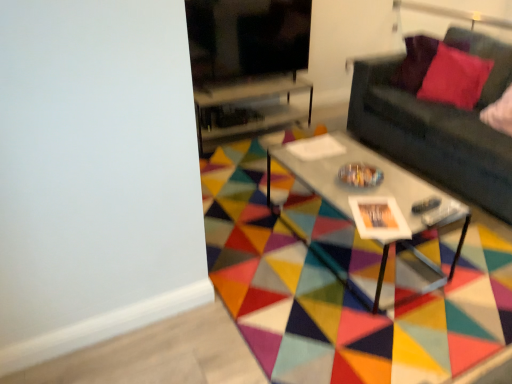
Question: Is the position of velvet red pillow at upper right less distant than that of dark gray fabric couch at right?

Choices:
 (A) yes
 (B) no

Answer: (B)

Question: From the image's perspective, is velvet red pillow at upper right under dark gray fabric couch at right?

Choices:
 (A) no
 (B) yes

Answer: (A)

Question: From the image's perspective, does velvet red pillow at upper right appear higher than dark gray fabric couch at right?

Choices:
 (A) no
 (B) yes

Answer: (B)

Question: From a real-world perspective, does velvet red pillow at upper right sit lower than dark gray fabric couch at right?

Choices:
 (A) yes
 (B) no

Answer: (B)

Question: Can you confirm if velvet red pillow at upper right is smaller than dark gray fabric couch at right?

Choices:
 (A) yes
 (B) no

Answer: (A)

Question: Is velvet red pillow at upper right completely or partially outside of dark gray fabric couch at right?

Choices:
 (A) yes
 (B) no

Answer: (B)

Question: Is the position of metallic gray coffee table at center less distant than that of geometric multicolored rug at center?

Choices:
 (A) yes
 (B) no

Answer: (B)

Question: Is metallic gray coffee table at center not inside geometric multicolored rug at center?

Choices:
 (A) yes
 (B) no

Answer: (A)

Question: Is metallic gray coffee table at center further to camera compared to geometric multicolored rug at center?

Choices:
 (A) yes
 (B) no

Answer: (A)

Question: Can you confirm if metallic gray coffee table at center is positioned to the left of geometric multicolored rug at center?

Choices:
 (A) yes
 (B) no

Answer: (B)

Question: From the image's perspective, is metallic gray coffee table at center below geometric multicolored rug at center?

Choices:
 (A) yes
 (B) no

Answer: (B)

Question: Can you confirm if metallic gray coffee table at center is wider than geometric multicolored rug at center?

Choices:
 (A) yes
 (B) no

Answer: (B)

Question: Can you confirm if transparent glass table at center is smaller than metallic gray coffee table at center?

Choices:
 (A) no
 (B) yes

Answer: (B)